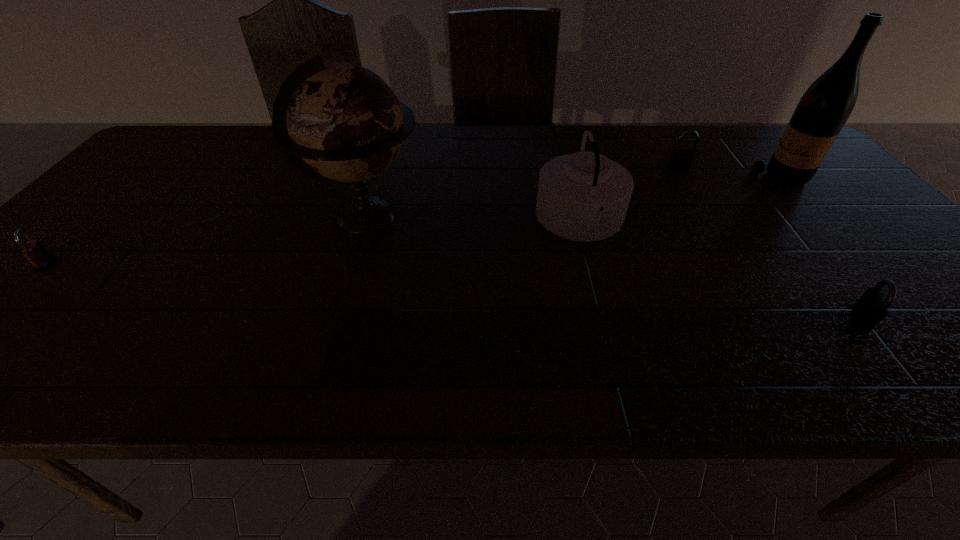
The width and height of the screenshot is (960, 540). I want to click on wine bottle, so click(x=823, y=110).

In order to click on globe in this screenshot , I will do `click(345, 125)`.

Find the location of `the fourth object from right to left`. the fourth object from right to left is located at coordinates coord(584,196).

This screenshot has height=540, width=960. Find the location of `the fourth shortest object`. the fourth shortest object is located at coordinates (584, 196).

At what (x,y) coordinates should I click in order to perform the action: click on the fourth object from left to right. Please return your answer as a coordinate pair (x, y). The image size is (960, 540). Looking at the image, I should click on (682, 156).

Locate an element on the screen. Image resolution: width=960 pixels, height=540 pixels. the farthest padlock is located at coordinates (682, 156).

At what (x,y) coordinates should I click in order to perform the action: click on the nearest object. Please return your answer as a coordinate pair (x, y). The height and width of the screenshot is (540, 960). Looking at the image, I should click on (870, 309).

Where is `the nearest padlock`? The width and height of the screenshot is (960, 540). the nearest padlock is located at coordinates (870, 309).

Identify the location of the leftmost object. (33, 250).

At what (x,y) coordinates should I click in order to perform the action: click on the second nearest padlock. Please return your answer as a coordinate pair (x, y). Looking at the image, I should click on (33, 250).